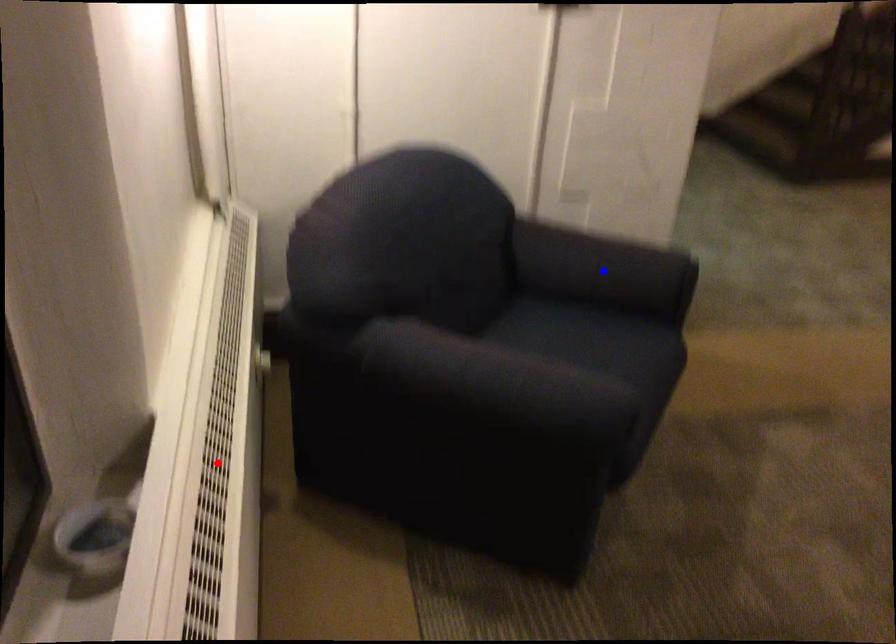
Question: Which of the two points in the image is closer to the camera?

Choices:
 (A) Blue point is closer.
 (B) Red point is closer.

Answer: (B)